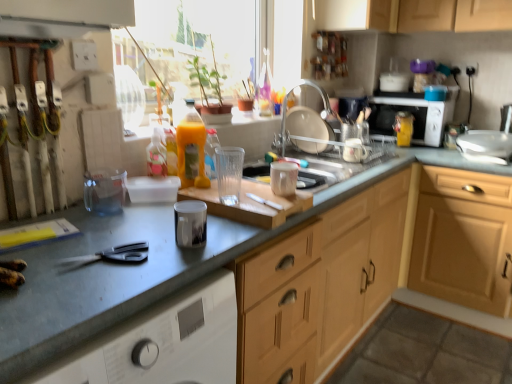
The width and height of the screenshot is (512, 384). What are the coordinates of `free space in front of black plastic scissors at lower left` in the screenshot? It's located at (78, 294).